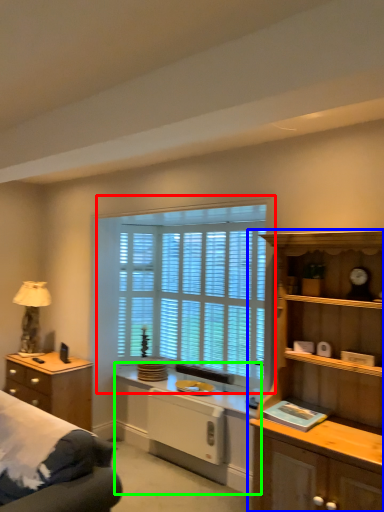
Question: Which is nearer to the window (highlighted by a red box)? cabinetry (highlighted by a blue box) or computer desk (highlighted by a green box).

Choices:
 (A) cabinetry
 (B) computer desk

Answer: (B)